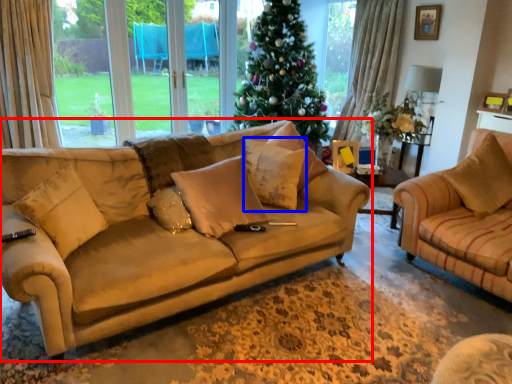
Question: Among these objects, which one is farthest to the camera, studio couch (highlighted by a red box) or pillow (highlighted by a blue box)?

Choices:
 (A) studio couch
 (B) pillow

Answer: (B)